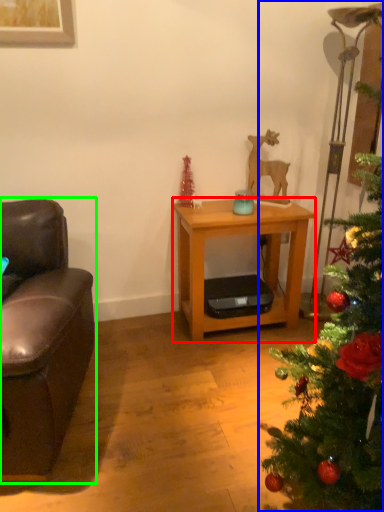
Question: Based on their relative distances, which object is nearer to desk (highlighted by a red box)? Choose from christmas tree (highlighted by a blue box) and studio couch (highlighted by a green box).

Choices:
 (A) christmas tree
 (B) studio couch

Answer: (B)